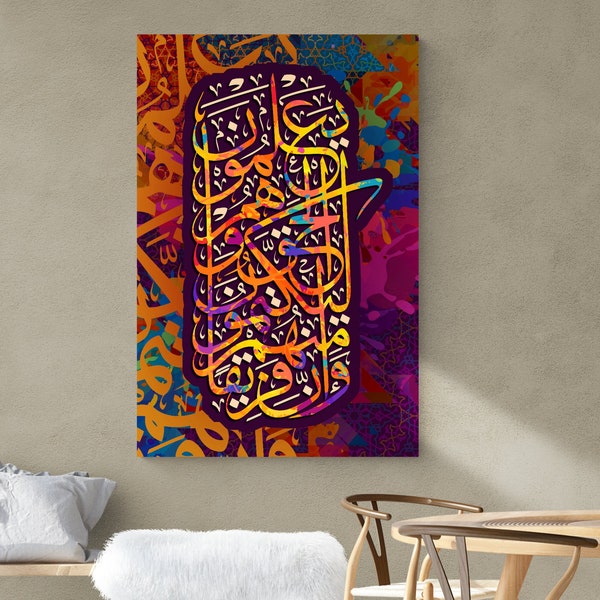
You are a GUI agent. You are given a task and a screenshot of the screen. Output one action in this format:
    pyautogui.click(x=<x>, y=<y>)
    Task: Click on the rolled blanket
    
    Given the screenshot: What is the action you would take?
    pyautogui.click(x=224, y=557)